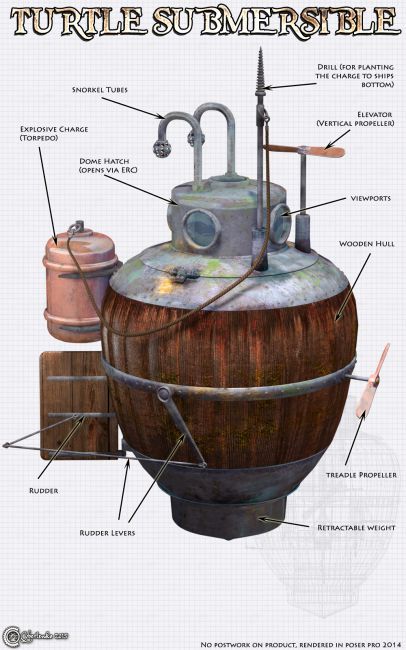
Find the location of a particular element. Image resolution: width=406 pixels, height=650 pixels. glass is located at coordinates (196, 231).